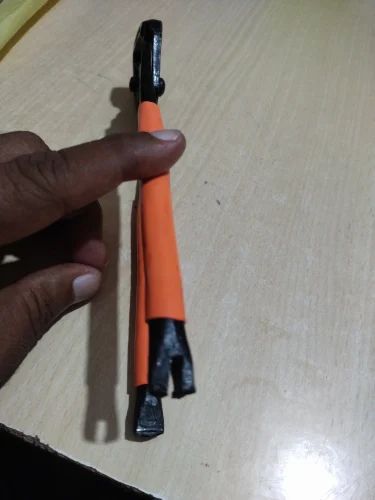
This screenshot has height=500, width=375. In order to click on wooden table in this screenshot , I will do `click(261, 187)`.